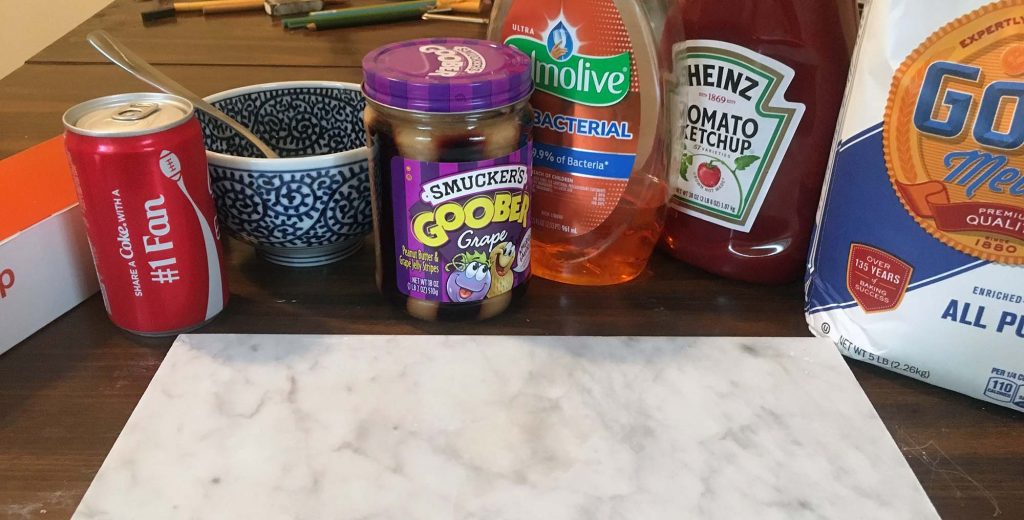
The width and height of the screenshot is (1024, 520). In order to click on jar in this screenshot , I will do `click(434, 117)`.